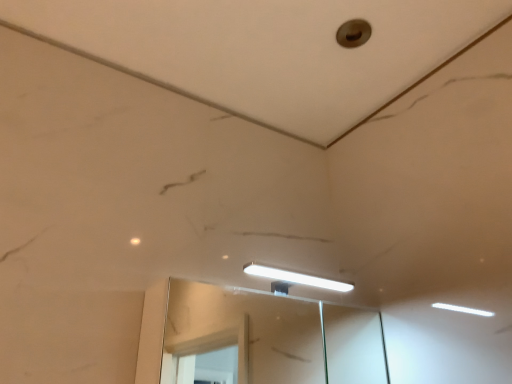
Question: Does metallic circular hole at upper center have a smaller size compared to clear glass mirror at center?

Choices:
 (A) yes
 (B) no

Answer: (A)

Question: Does metallic circular hole at upper center appear on the left side of clear glass mirror at center?

Choices:
 (A) no
 (B) yes

Answer: (A)

Question: Does metallic circular hole at upper center contain clear glass mirror at center?

Choices:
 (A) no
 (B) yes

Answer: (A)

Question: Is metallic circular hole at upper center outside of clear glass mirror at center?

Choices:
 (A) no
 (B) yes

Answer: (B)

Question: From the image's perspective, is metallic circular hole at upper center beneath clear glass mirror at center?

Choices:
 (A) no
 (B) yes

Answer: (A)

Question: Is metallic circular hole at upper center bigger than clear glass mirror at center?

Choices:
 (A) yes
 (B) no

Answer: (B)

Question: Does clear glass mirror at center have a lesser height compared to metallic circular hole at upper center?

Choices:
 (A) no
 (B) yes

Answer: (A)

Question: Considering the relative sizes of clear glass mirror at center and metallic circular hole at upper center in the image provided, is clear glass mirror at center taller than metallic circular hole at upper center?

Choices:
 (A) no
 (B) yes

Answer: (B)

Question: From the image's perspective, is clear glass mirror at center on top of metallic circular hole at upper center?

Choices:
 (A) no
 (B) yes

Answer: (A)

Question: Considering the relative sizes of clear glass mirror at center and metallic circular hole at upper center in the image provided, is clear glass mirror at center smaller than metallic circular hole at upper center?

Choices:
 (A) no
 (B) yes

Answer: (A)

Question: From the image's perspective, does clear glass mirror at center appear lower than metallic circular hole at upper center?

Choices:
 (A) yes
 (B) no

Answer: (A)

Question: Does clear glass mirror at center appear on the right side of metallic circular hole at upper center?

Choices:
 (A) yes
 (B) no

Answer: (B)

Question: Does point (220, 316) appear closer or farther from the camera than point (364, 41)?

Choices:
 (A) closer
 (B) farther

Answer: (B)